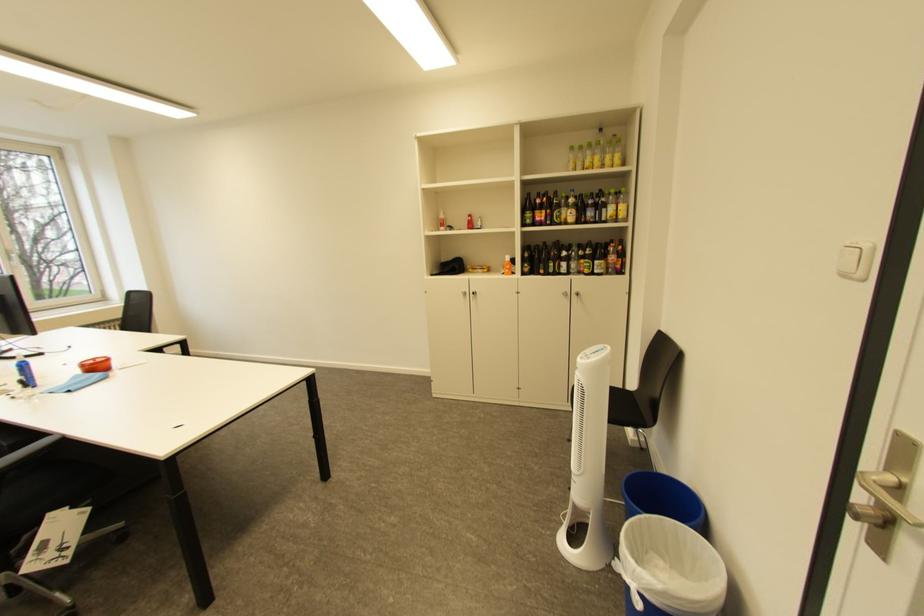
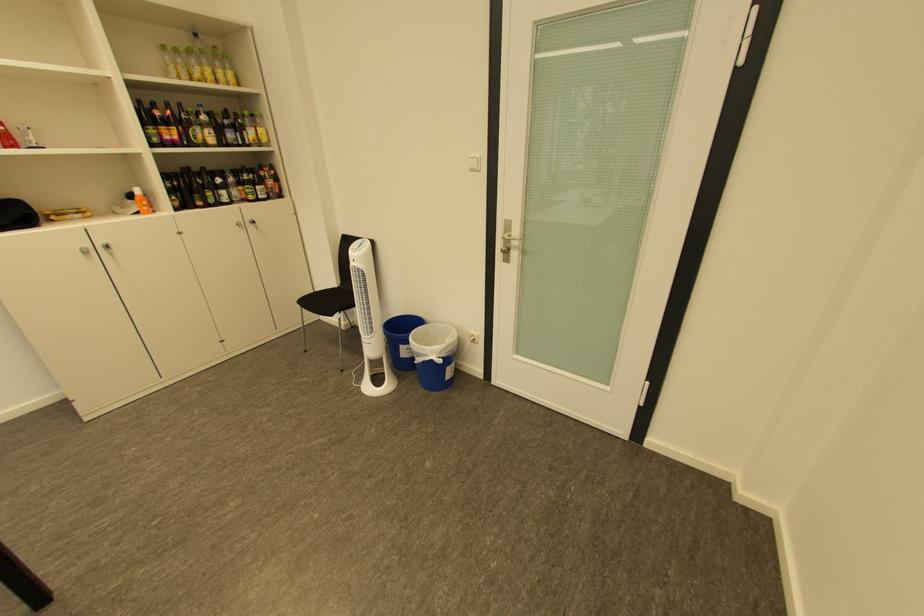
Question: I am providing you with two images of the same scene from different viewpoints. Please identify which objects are invisible in image2.

Choices:
 (A) silver cabinet handle
 (B) yellow plastic bottle
 (C) orange spray bottle
 (D) none of these

Answer: (D)